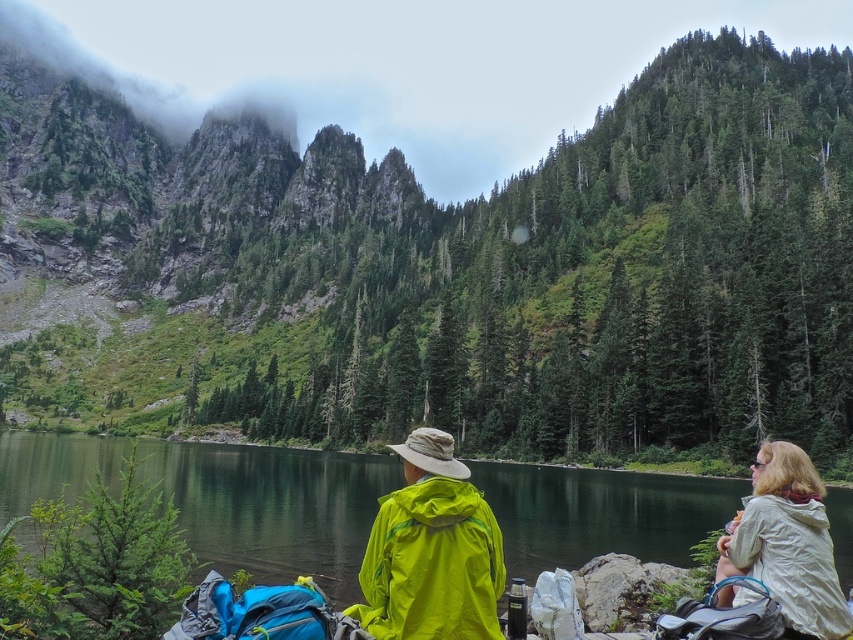
Is green matte water at center smaller than light beige jacket at lower right?

Incorrect, green matte water at center is not smaller in size than light beige jacket at lower right.

Is green matte water at center shorter than light beige jacket at lower right?

Yes, green matte water at center is shorter than light beige jacket at lower right.

Is point (250, 541) positioned in front of point (784, 605)?

No, (250, 541) is further to viewer.

At what (x,y) coordinates should I click in order to perform the action: click on green matte water at center. Please return your answer as a coordinate pair (x, y). Looking at the image, I should click on (274, 508).

This screenshot has height=640, width=853. Describe the element at coordinates (444, 269) in the screenshot. I see `green forested mountain at center` at that location.

Who is shorter, green forested mountain at center or green matte water at center?

green matte water at center

Who is more distant from viewer, (x=80, y=387) or (x=683, y=513)?

Positioned behind is point (x=80, y=387).

Locate an element on the screen. green forested mountain at center is located at coordinates (444, 269).

You are a GUI agent. You are given a task and a screenshot of the screen. Output one action in this format:
    pyautogui.click(x=<x>, y=<y>)
    Task: Click on the green forested mountain at center
    The width and height of the screenshot is (853, 640).
    Given the screenshot: What is the action you would take?
    pyautogui.click(x=444, y=269)

Is point (711, 96) positioned in front of point (756, 516)?

No, (711, 96) is behind (756, 516).

The width and height of the screenshot is (853, 640). I want to click on green forested mountain at center, so click(444, 269).

Image resolution: width=853 pixels, height=640 pixels. I want to click on green forested mountain at center, so click(444, 269).